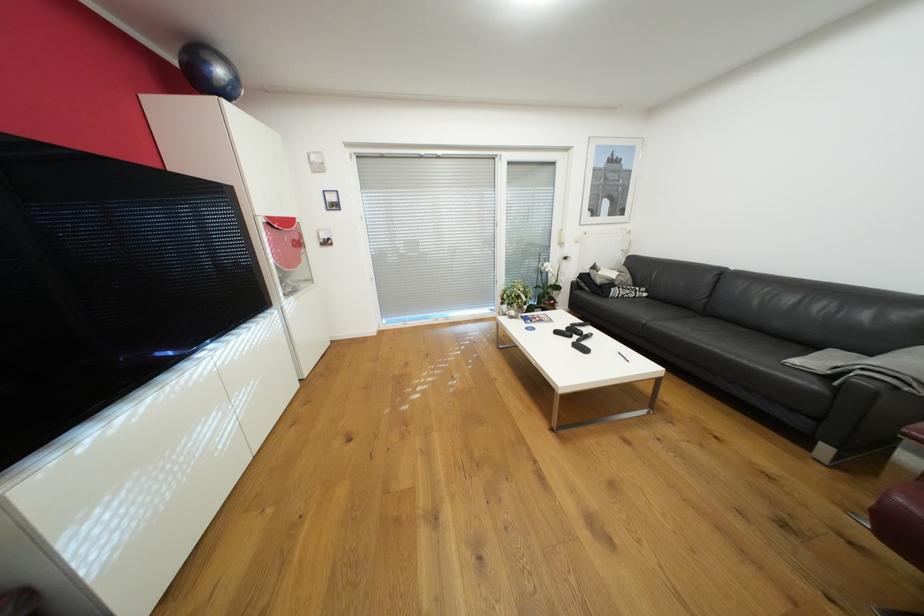
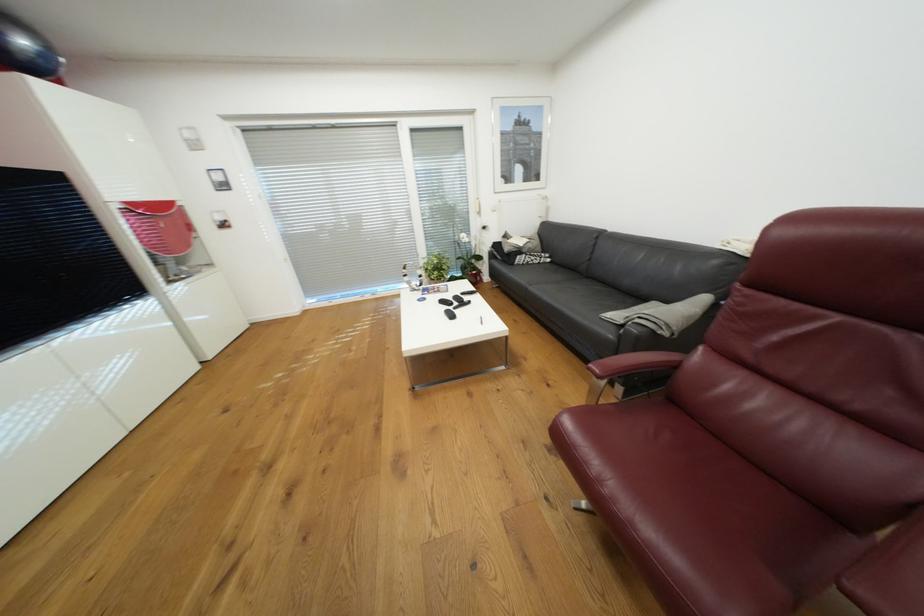
Question: Based on the continuous images, in which direction is the camera rotating? Reply with the corresponding letter.

Choices:
 (A) Left
 (B) Right
 (C) Up
 (D) Down

Answer: (D)